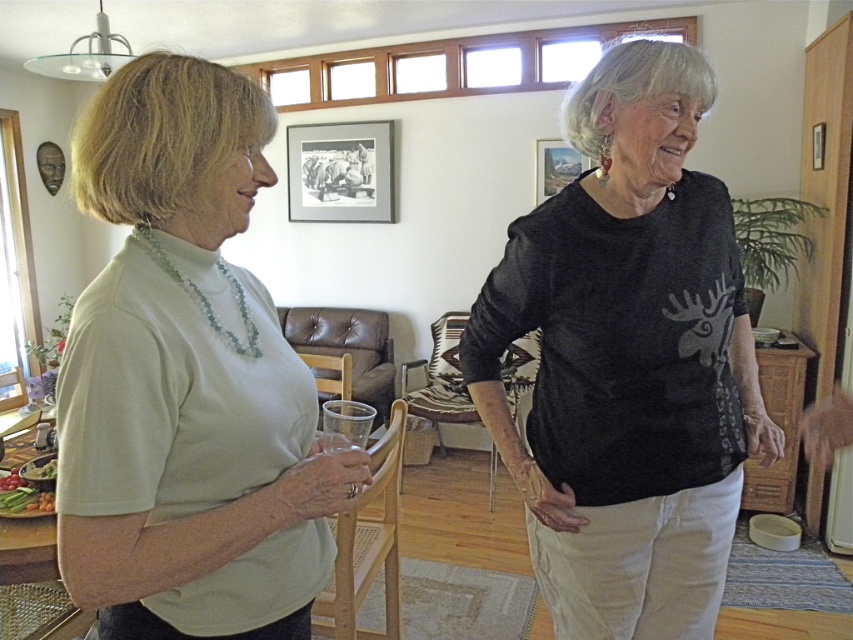
Question: Which point is closer to the camera?

Choices:
 (A) (184, 182)
 (B) (585, 467)
 (C) (380, 122)

Answer: (A)

Question: From the image, what is the correct spatial relationship of light beige t-shirt at left in relation to charcoal heathered shirt at center?

Choices:
 (A) right
 (B) left

Answer: (B)

Question: Which of the following is the farthest from the observer?

Choices:
 (A) click(x=543, y=147)
 (B) click(x=595, y=349)
 (C) click(x=252, y=376)

Answer: (A)

Question: Which point is farther to the camera?

Choices:
 (A) (158, 548)
 (B) (646, 321)

Answer: (B)

Question: Can you confirm if charcoal heathered shirt at center is positioned above metallic silver picture frame at upper center?

Choices:
 (A) no
 (B) yes

Answer: (A)

Question: Can you confirm if charcoal heathered shirt at center is smaller than metallic silver picture frame at upper right?

Choices:
 (A) yes
 (B) no

Answer: (B)